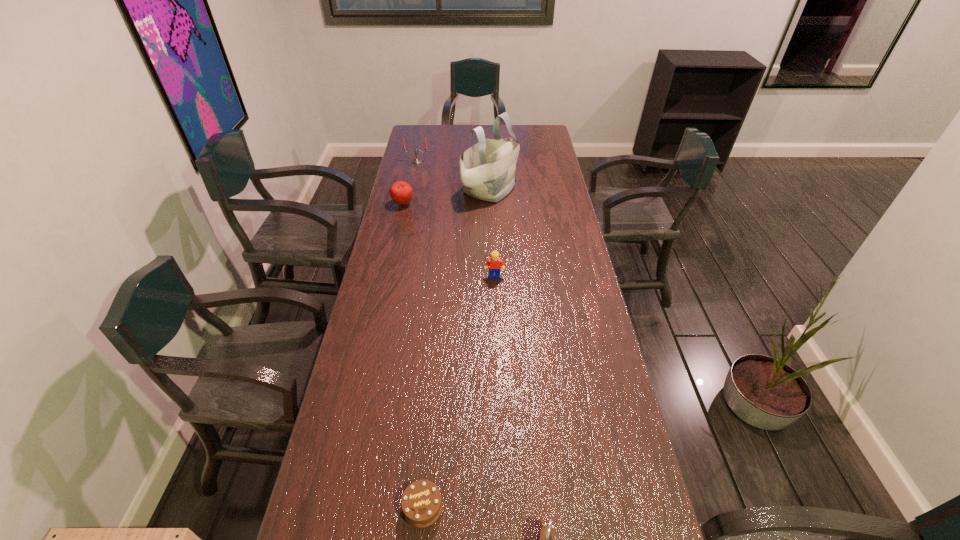
The image size is (960, 540). I want to click on candle that is at the left edge, so click(415, 161).

Image resolution: width=960 pixels, height=540 pixels. I want to click on apple that is at the left edge, so click(401, 192).

In the image, there is a desktop. Where is `vacant space at the far edge`? vacant space at the far edge is located at coordinates (452, 132).

Identify the location of vacant space at the left edge. This screenshot has height=540, width=960. (377, 396).

Identify the location of vacant space at the right edge. (544, 269).

In the image, there is a desktop. Where is `free space at the far left corner`? Image resolution: width=960 pixels, height=540 pixels. free space at the far left corner is located at coordinates (437, 134).

The height and width of the screenshot is (540, 960). I want to click on vacant area that lies between the candle and the shortest object, so click(x=420, y=334).

The width and height of the screenshot is (960, 540). I want to click on free spot between the shopping bag and the Lego, so click(x=492, y=233).

The image size is (960, 540). In order to click on free space between the shortest object and the Lego in this screenshot , I will do `click(459, 392)`.

This screenshot has width=960, height=540. In order to click on vacant point located between the farthest object and the apple in this screenshot , I will do `click(410, 183)`.